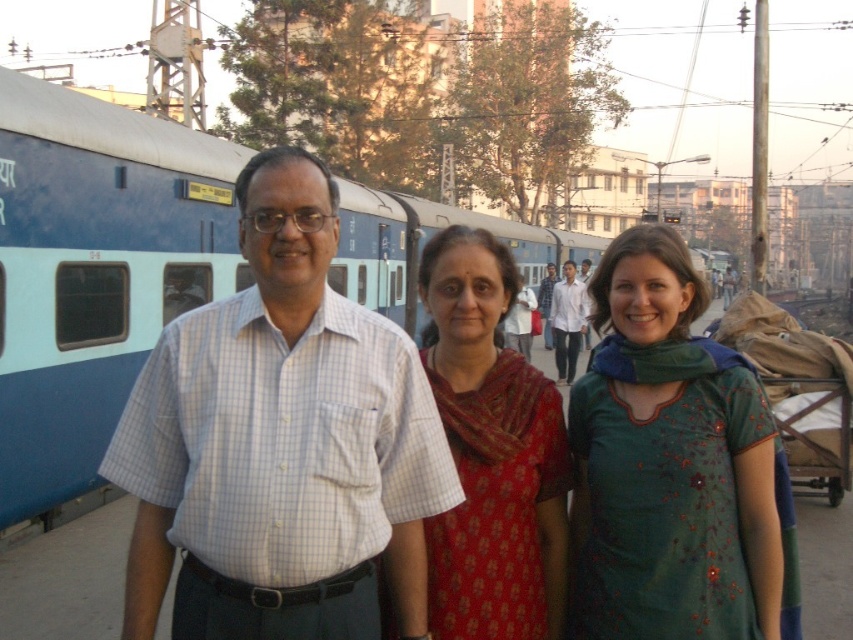
You are a photographer trying to capture a clear photo of the red silk saree at center without the blue painted metal train at left blocking it. Where should you move to ensure the train is out of the frame?

The red silk saree at center is behind the blue painted metal train at left, so moving to the right side of the train would position the train between you and the saree, but since the saree is behind the train, you need to move to the left side of the train to have the saree visible without obstruction.

You are a photographer planning to take a group photo of the green cotton dress at center and the red silk saree at center. Which of the two has a wider silhouette that you should account for in your composition?

The green cotton dress at center has a wider silhouette than the red silk saree at center, so you should position the green cotton dress at center in a way that accommodates its width in the composition.

You are standing at the entrance of the railway station and want to find the person wearing the red silk saree at center. According to the coordinates provided, in which direction should you look relative to your current position?

The red silk saree at center is located at coordinates point (491, 452). Since the coordinate system typically places (0, 0) at the bottom left corner and (852, 639) at the top right corner, the x value of 0.709 indicates a position to the right, and the y value of 0.577 indicates a position above the bottom. Therefore, you should look towards the upper right direction from your current position at the entrance.